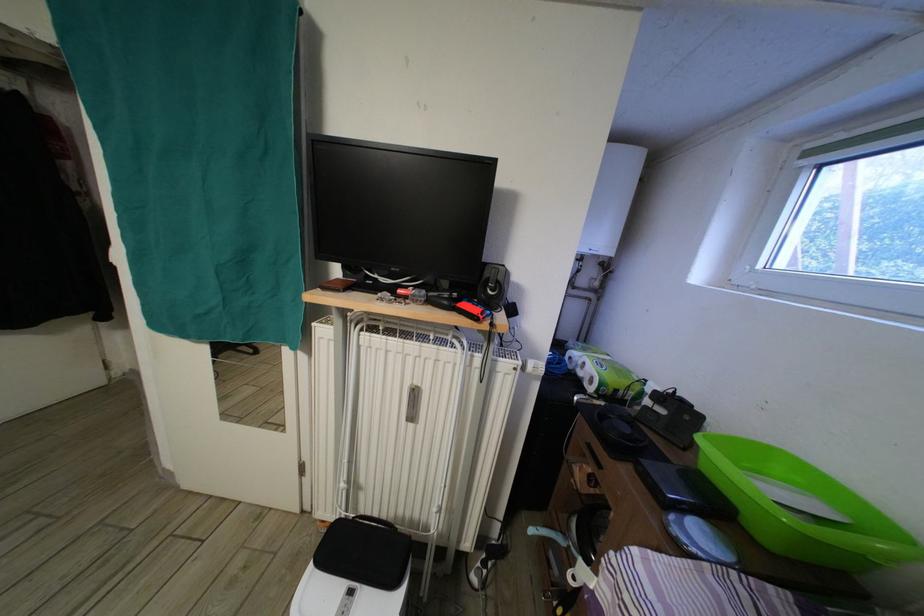
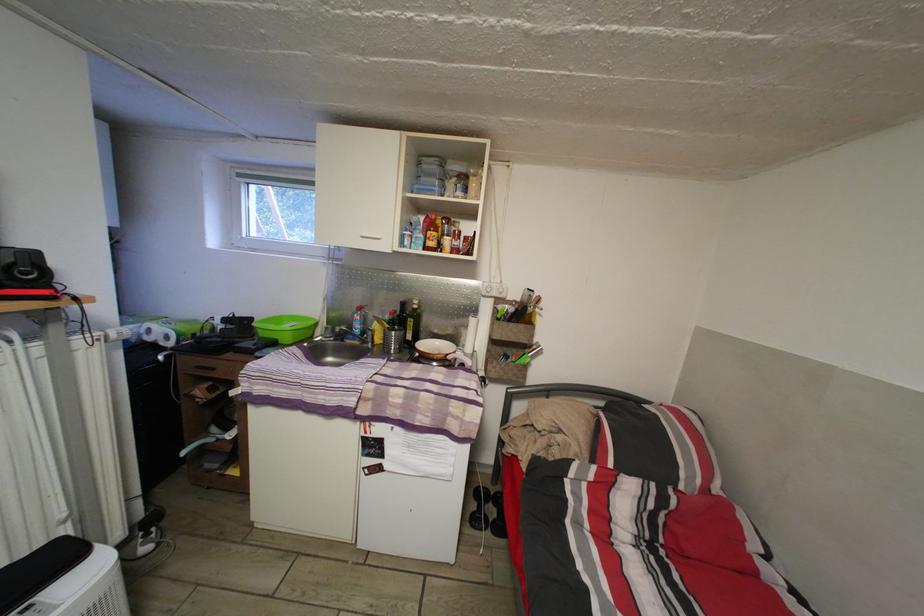
Find the pixel in the second image that matches point (591, 355) in the first image.

(144, 328)